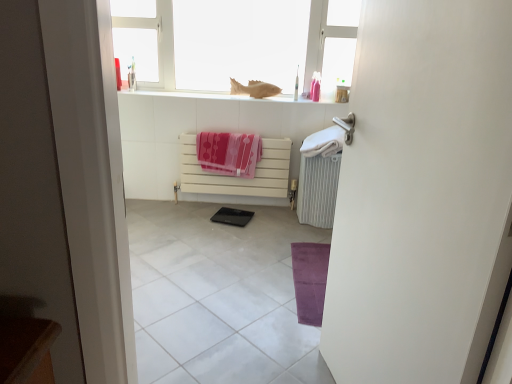
The height and width of the screenshot is (384, 512). What are the coordinates of `vacant space positioned to the left of purple velvety yoga mat at lower right` in the screenshot? It's located at (233, 272).